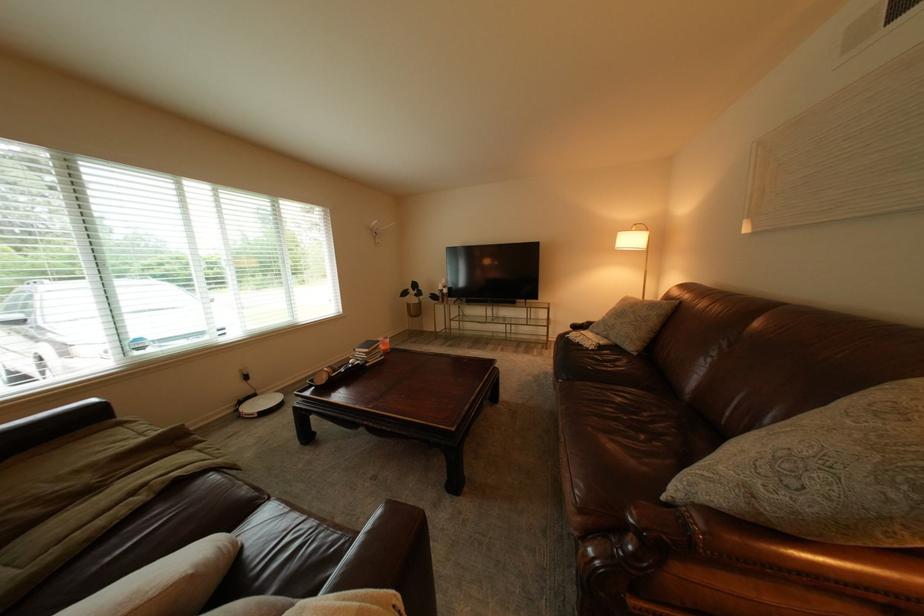
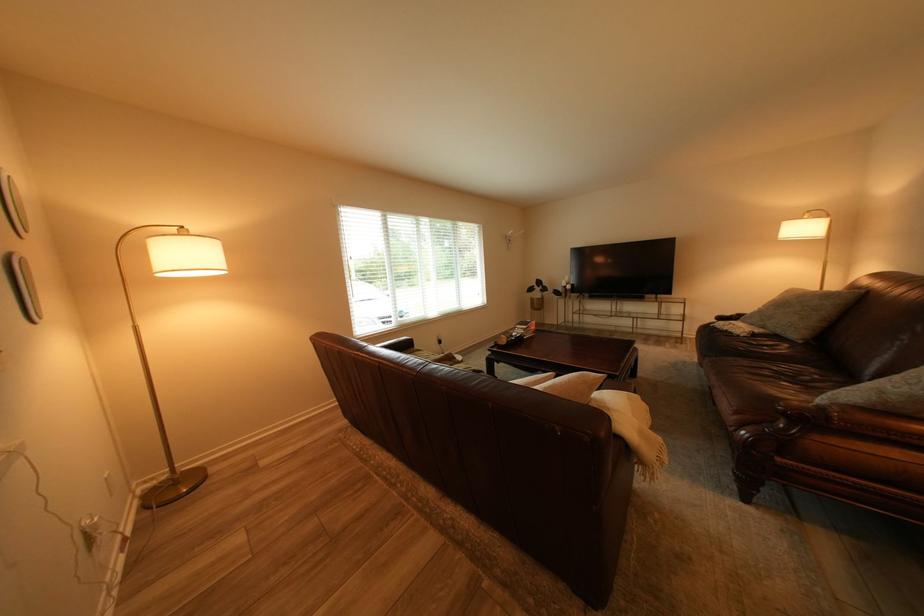
In a continuous first-person perspective shot, in which direction is the camera moving?

The cameraman walked toward left, backward.